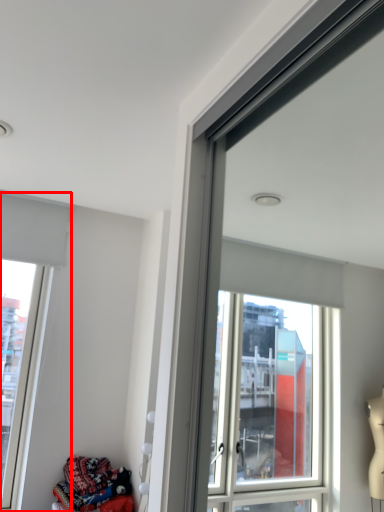
Question: Where is window (annotated by the red box) located in relation to clothing in the image?

Choices:
 (A) left
 (B) right

Answer: (A)